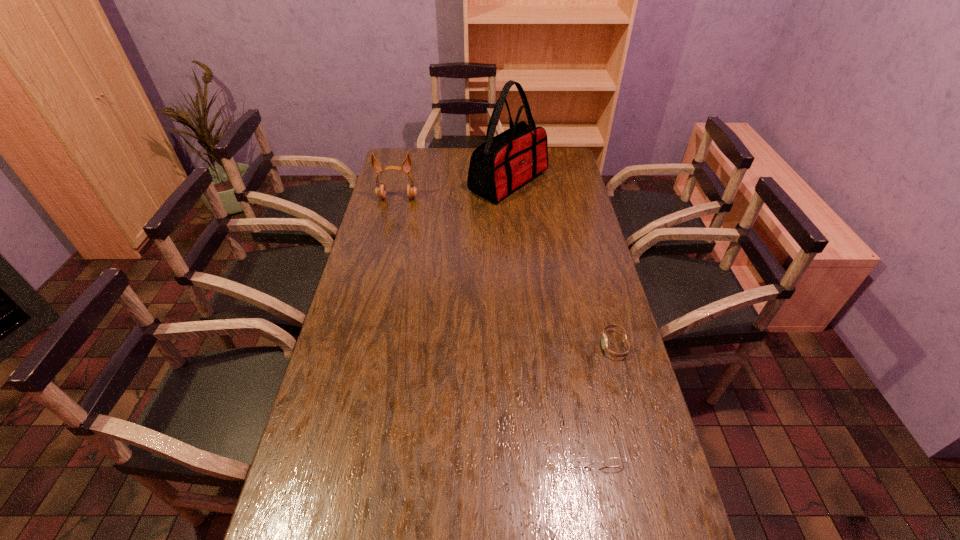
Identify the location of vacant area between the rightmost object and the earphone. The image size is (960, 540). (506, 272).

The image size is (960, 540). I want to click on object that is the second nearest to the leftmost object, so click(x=604, y=342).

In order to click on the second closest object to the earphone in this screenshot , I will do `click(604, 342)`.

Locate an element on the screen. The image size is (960, 540). vacant space that satisfies the following two spatial constraints: 1. on the face of the rightmost object; 2. on the front-facing side of the spectacles is located at coordinates (639, 441).

Find the location of a particular element. The height and width of the screenshot is (540, 960). vacant space that satisfies the following two spatial constraints: 1. on the face of the second nearest object; 2. on the front-facing side of the spectacles is located at coordinates (639, 441).